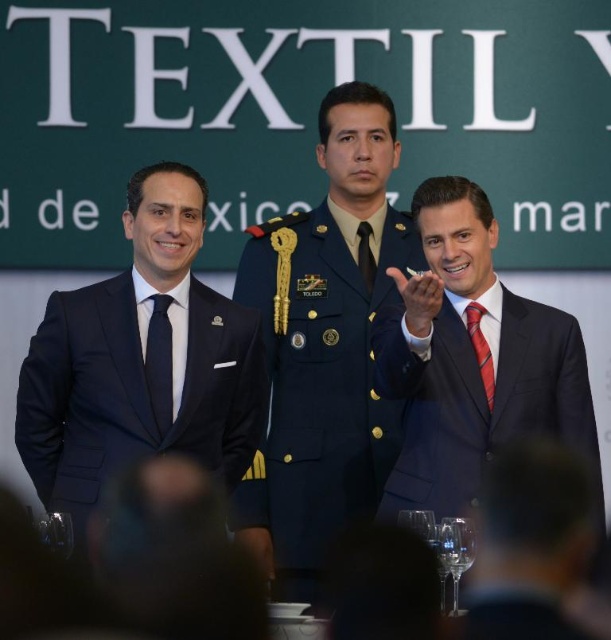
Is shiny dark suit at right smaller than dark blue silk tie at center?

No, shiny dark suit at right is not smaller than dark blue silk tie at center.

In the scene shown: Can you confirm if shiny dark suit at right is positioned above dark blue silk tie at center?

Actually, shiny dark suit at right is below dark blue silk tie at center.

You are a GUI agent. You are given a task and a screenshot of the screen. Output one action in this format:
    pyautogui.click(x=<x>, y=<y>)
    Task: Click on the shiny dark suit at right
    
    Given the screenshot: What is the action you would take?
    pyautogui.click(x=475, y=364)

Who is positioned more to the right, navy blue uniform at center or matte black tie at center?

matte black tie at center

Identify the location of navy blue uniform at center. (323, 346).

Does point (338, 170) come behind point (364, 275)?

Yes, point (338, 170) is farther from viewer.

Find the location of `navy blue uniform at center`. navy blue uniform at center is located at coordinates (323, 346).

Can you confirm if red striped tie at right is smaller than matte black tie at center?

Actually, red striped tie at right might be larger than matte black tie at center.

Does point (478, 308) come closer to viewer compared to point (360, 237)?

Yes, it is in front of point (360, 237).

You are a GUI agent. You are given a task and a screenshot of the screen. Output one action in this format:
    pyautogui.click(x=<x>, y=<y>)
    Task: Click on the red striped tie at right
    This screenshot has height=640, width=611.
    Given the screenshot: What is the action you would take?
    pyautogui.click(x=480, y=349)